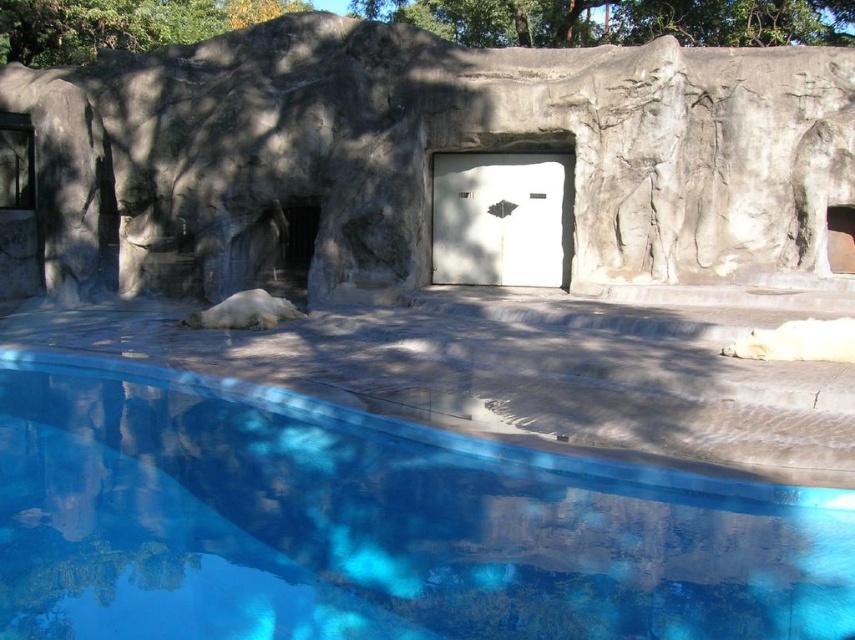
You are a zookeeper planning to install a new feeding station in the zoo enclosure. You need to place it between the gray stone wall at center and the green leafy tree at upper center. Which object should be on your left when facing the feeding station?

The gray stone wall at center should be on your left when facing the feeding station because it is positioned on the left side of the green leafy tree at upper center according to the description.

You are a zookeeper who needs to clean the blue smooth water at lower center and the green leafy tree at upper center. Which object is closer to you so you can reach it first without moving your position?

The blue smooth water at lower center is closer to the viewer than the green leafy tree at upper center, so you can reach it first without moving your position.

From the picture: You are a zookeeper standing at the entrance of the zoo enclosure. You need to reach the blue smooth water at lower center to check its water quality. What coordinate should you look for?

The blue smooth water at lower center is located at coordinate point [373,525].